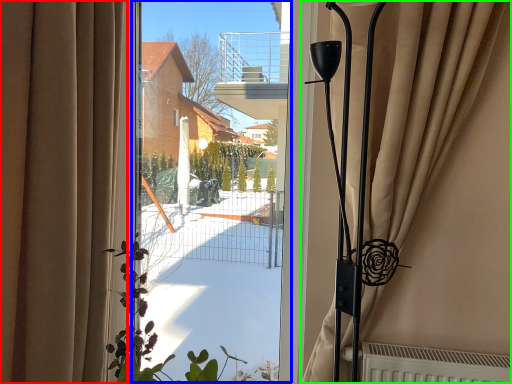
Question: Which object is the farthest from curtain (highlighted by a red box)? Choose among these: window screen (highlighted by a blue box) or curtain (highlighted by a green box).

Choices:
 (A) window screen
 (B) curtain

Answer: (B)